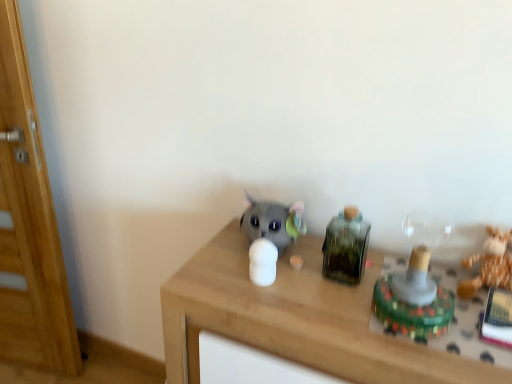
Question: Which direction should I rotate to face matte gray plush toy at center, arranged as the 4th toy when viewed from the right, — up or down?

Choices:
 (A) down
 (B) up

Answer: (A)

Question: Is brown plush toy at right, which ranks as the 1th toy in right-to-left order, in front of translucent plastic toy at right, the third toy when ordered from left to right?

Choices:
 (A) no
 (B) yes

Answer: (A)

Question: Is brown plush toy at right, which ranks as the 1th toy in right-to-left order, placed right next to translucent plastic toy at right, the second toy positioned from the right?

Choices:
 (A) no
 (B) yes

Answer: (A)

Question: Would you say brown plush toy at right, which is the fourth toy from left to right, is outside translucent plastic toy at right, the second toy positioned from the right?

Choices:
 (A) yes
 (B) no

Answer: (A)

Question: Is brown plush toy at right, which ranks as the 1th toy in right-to-left order, facing towards translucent plastic toy at right, the third toy when ordered from left to right?

Choices:
 (A) yes
 (B) no

Answer: (B)

Question: Does brown plush toy at right, which is the fourth toy from left to right, have a larger size compared to translucent plastic toy at right, the second toy positioned from the right?

Choices:
 (A) yes
 (B) no

Answer: (B)

Question: Does brown plush toy at right, which is the fourth toy from left to right, appear on the left side of translucent plastic toy at right, the third toy when ordered from left to right?

Choices:
 (A) yes
 (B) no

Answer: (B)

Question: Can you confirm if wooden table at center is bigger than wooden door at left?

Choices:
 (A) no
 (B) yes

Answer: (B)

Question: Does wooden table at center have a smaller size compared to wooden door at left?

Choices:
 (A) no
 (B) yes

Answer: (A)

Question: Does wooden table at center have a lesser height compared to wooden door at left?

Choices:
 (A) no
 (B) yes

Answer: (B)

Question: Considering the relative positions of wooden table at center and wooden door at left in the image provided, is wooden table at center to the left of wooden door at left from the viewer's perspective?

Choices:
 (A) yes
 (B) no

Answer: (B)

Question: From a real-world perspective, is wooden table at center located beneath wooden door at left?

Choices:
 (A) yes
 (B) no

Answer: (A)

Question: Is wooden table at center oriented towards wooden door at left?

Choices:
 (A) yes
 (B) no

Answer: (B)

Question: Considering the relative positions of wooden door at left and matte gray plush toy at center, positioned as the 1th toy in left-to-right order, in the image provided, is wooden door at left to the left of matte gray plush toy at center, positioned as the 1th toy in left-to-right order, from the viewer's perspective?

Choices:
 (A) no
 (B) yes

Answer: (B)